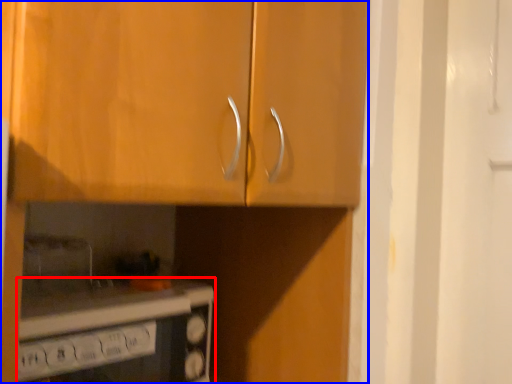
Question: Which of the following is the closest to the observer, home appliance (highlighted by a red box) or cabinetry (highlighted by a blue box)?

Choices:
 (A) home appliance
 (B) cabinetry

Answer: (B)